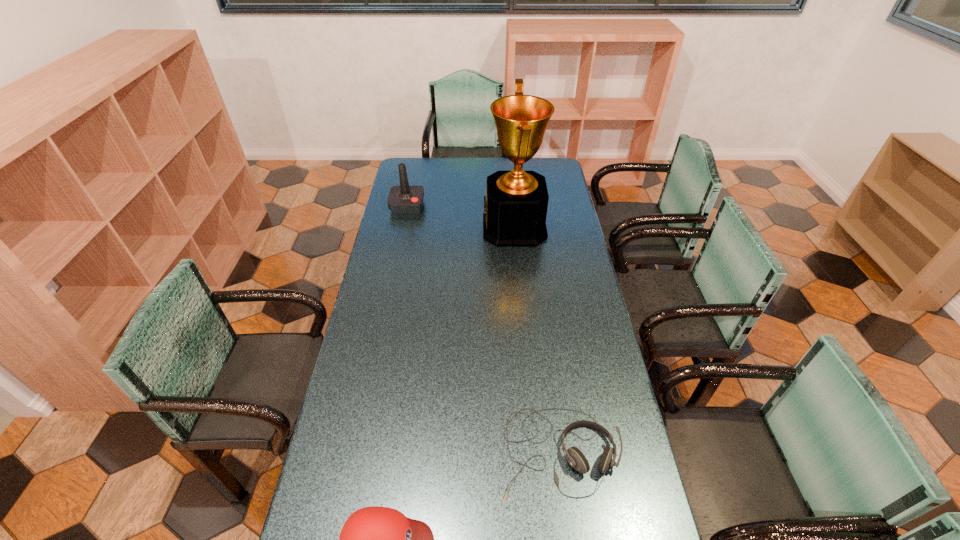
At what (x,y) coordinates should I click in order to perform the action: click on vacant space at the left edge. Please return your answer as a coordinate pair (x, y). Looking at the image, I should click on (367, 315).

You are a GUI agent. You are given a task and a screenshot of the screen. Output one action in this format:
    pyautogui.click(x=<x>, y=<y>)
    Task: Click on the vacant region at the right edge of the desktop
    The width and height of the screenshot is (960, 540).
    Given the screenshot: What is the action you would take?
    pyautogui.click(x=560, y=222)

The height and width of the screenshot is (540, 960). In the image, there is a desktop. In order to click on free space at the far left corner in this screenshot , I will do `click(415, 158)`.

Locate an element on the screen. This screenshot has height=540, width=960. free space at the far right corner of the desktop is located at coordinates (553, 168).

Identify the location of empty space between the third farthest object and the trophy cup. (537, 340).

Find the location of a particular element. The image size is (960, 540). unoccupied position between the second tallest object and the third farthest object is located at coordinates (483, 329).

Where is `unoccupied position between the joystick and the third farthest object`? The height and width of the screenshot is (540, 960). unoccupied position between the joystick and the third farthest object is located at coordinates (483, 329).

Identify the location of unoccupied position between the third farthest object and the joystick. (483, 329).

Image resolution: width=960 pixels, height=540 pixels. Find the location of `object that is the closest to the third farthest object`. object that is the closest to the third farthest object is located at coordinates [375, 539].

Identify which object is the closest to the baseball cap. Please provide its 2D coordinates. Your answer should be formatted as a tuple, i.e. [(x, y)], where the tuple contains the x and y coordinates of a point satisfying the conditions above.

[(576, 459)]